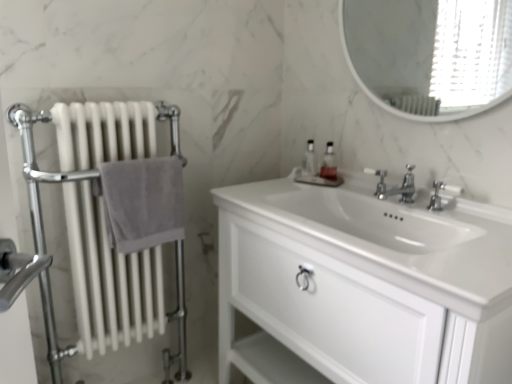
I want to click on free region on the left part of polished chrome faucet at center, so click(335, 193).